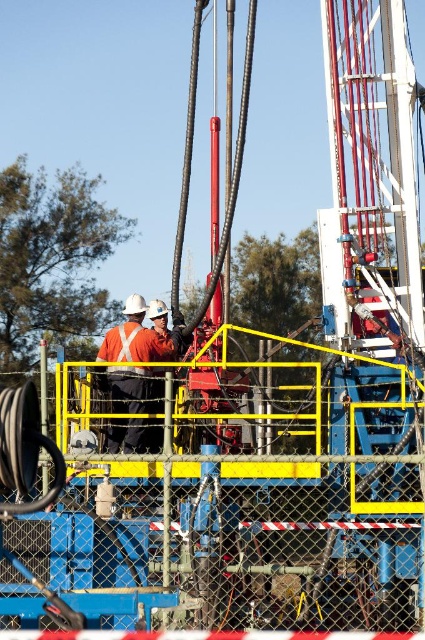
Question: Which of the following is the closest to the observer?

Choices:
 (A) orange reflective vest at center
 (B) orange reflective safety vest at center

Answer: (A)

Question: Does orange reflective vest at center have a lesser width compared to orange reflective safety vest at center?

Choices:
 (A) yes
 (B) no

Answer: (B)

Question: Can you confirm if orange reflective vest at center is bigger than orange reflective safety vest at center?

Choices:
 (A) yes
 (B) no

Answer: (A)

Question: Which object appears farthest from the camera in this image?

Choices:
 (A) orange reflective vest at center
 (B) orange reflective safety vest at center

Answer: (B)

Question: Is the position of orange reflective vest at center less distant than that of orange reflective safety vest at center?

Choices:
 (A) yes
 (B) no

Answer: (A)